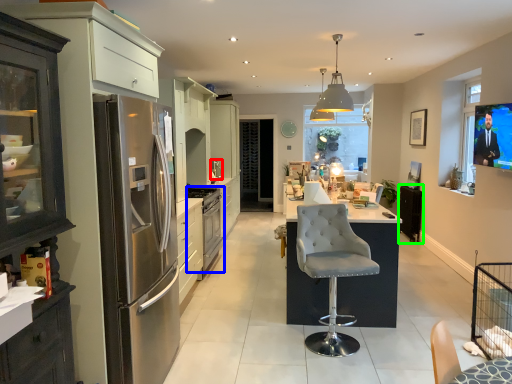
Question: Based on their relative distances, which object is farther from appliance (highlighted by a red box)? Choose from kitchen appliance (highlighted by a blue box) and appliance (highlighted by a green box).

Choices:
 (A) kitchen appliance
 (B) appliance

Answer: (B)